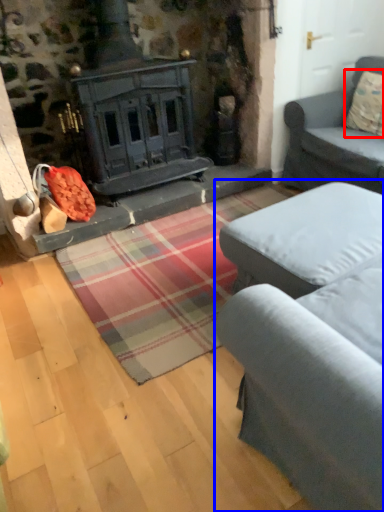
Question: Which point is further to the camera, pillow (highlighted by a red box) or studio couch (highlighted by a blue box)?

Choices:
 (A) pillow
 (B) studio couch

Answer: (A)